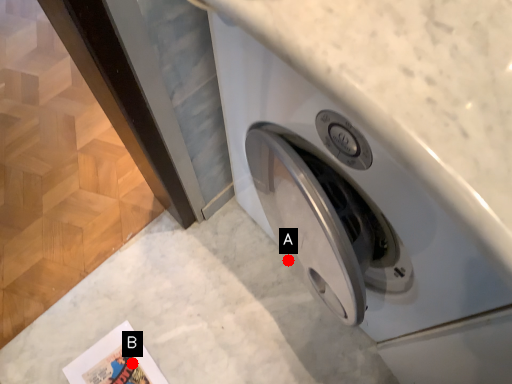
Question: Two points are circled on the image, labeled by A and B beside each circle. Which point appears closest to the camera in this image?

Choices:
 (A) A is closer
 (B) B is closer

Answer: (B)